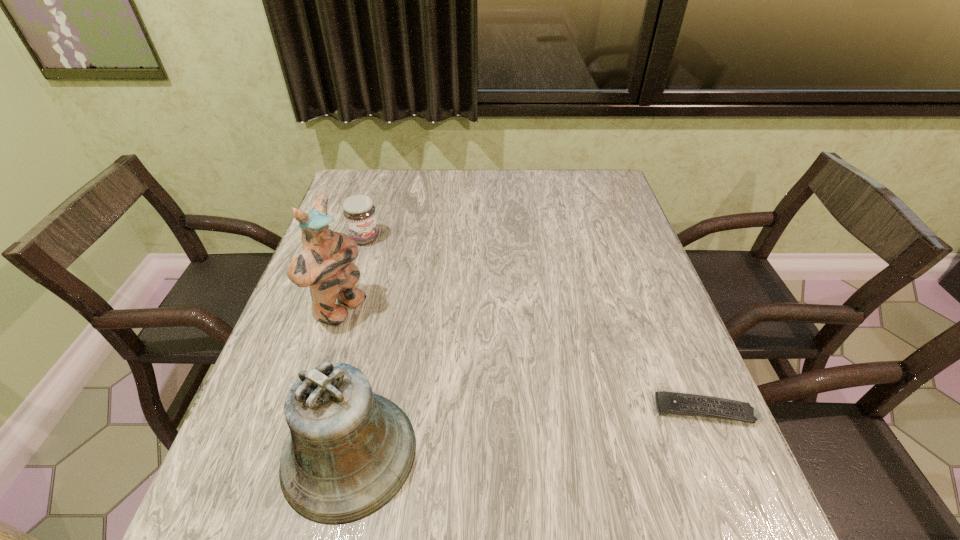
Locate an element on the screen. The width and height of the screenshot is (960, 540). bell is located at coordinates (349, 452).

Identify the location of remote control. (675, 403).

Where is `the rightmost object`? This screenshot has height=540, width=960. the rightmost object is located at coordinates (675, 403).

This screenshot has width=960, height=540. Identify the location of the third tallest object. (359, 212).

The image size is (960, 540). Identify the location of the farthest object. (359, 212).

The height and width of the screenshot is (540, 960). I want to click on the tallest object, so click(325, 264).

Image resolution: width=960 pixels, height=540 pixels. In order to click on figurine in this screenshot , I will do `click(325, 264)`.

The height and width of the screenshot is (540, 960). I want to click on vacant space situated 0.070m on the left of the bell, so click(x=244, y=453).

This screenshot has width=960, height=540. Identify the location of blank space located 0.290m on the back of the shortest object. tap(657, 293).

Locate an element on the screen. The height and width of the screenshot is (540, 960). free space located 0.260m on the front label of the second shortest object is located at coordinates (419, 301).